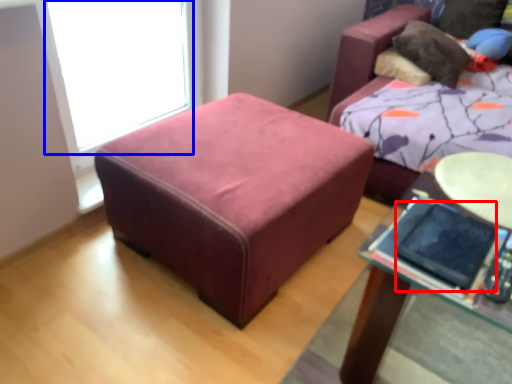
Question: Which point is further to the camera, ipad (highlighted by a red box) or window screen (highlighted by a blue box)?

Choices:
 (A) ipad
 (B) window screen

Answer: (B)